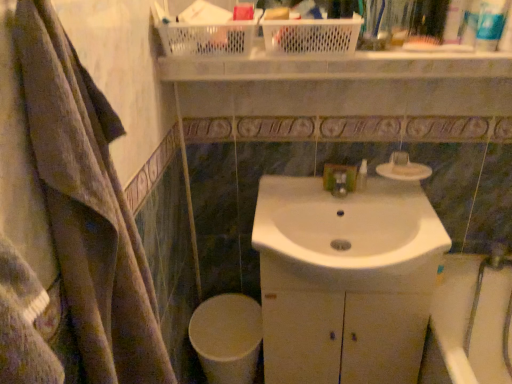
Where is `space that is in front of green matte soap dispenser at center, the fourth toiletry when ordered from front to back`? The width and height of the screenshot is (512, 384). space that is in front of green matte soap dispenser at center, the fourth toiletry when ordered from front to back is located at coordinates (387, 204).